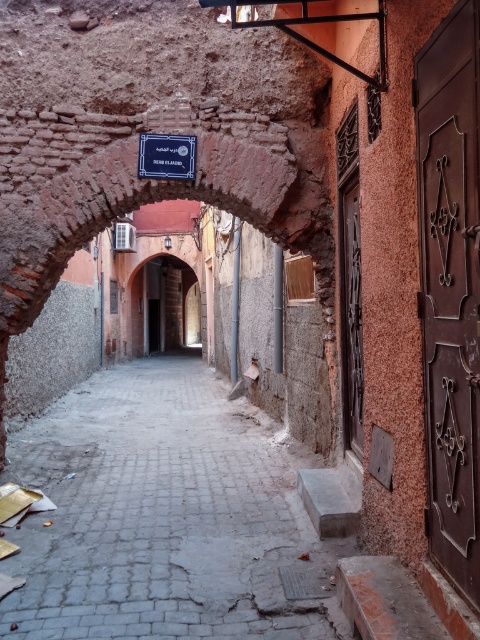
Question: Which object appears closest to the camera in this image?

Choices:
 (A) rustic stone archway at center
 (B) blue metallic sign at center
 (C) gray concrete alley at center

Answer: (C)

Question: Which object is closer to the camera taking this photo?

Choices:
 (A) gray concrete alley at center
 (B) blue metallic sign at center
 (C) rustic stone archway at center

Answer: (A)

Question: Among these points, which one is nearest to the camera?

Choices:
 (A) (156, 145)
 (B) (144, 596)
 (C) (162, 275)

Answer: (B)

Question: Does rustic stone archway at center have a smaller size compared to blue metallic sign at center?

Choices:
 (A) no
 (B) yes

Answer: (A)

Question: Does gray concrete alley at center have a greater width compared to rustic stone archway at center?

Choices:
 (A) yes
 (B) no

Answer: (A)

Question: Is gray concrete alley at center smaller than blue metallic sign at center?

Choices:
 (A) yes
 (B) no

Answer: (B)